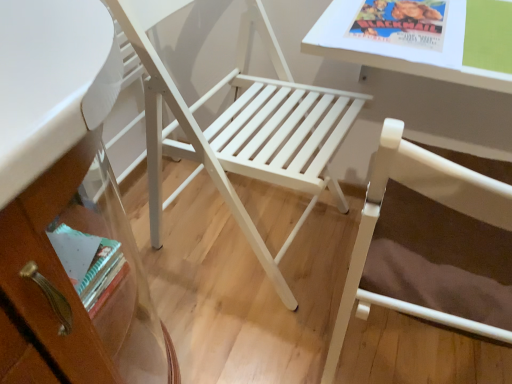
The width and height of the screenshot is (512, 384). Identify the location of free space to the left of white wood chair at center, which is counted as the second chair, starting from the left. [x=249, y=334].